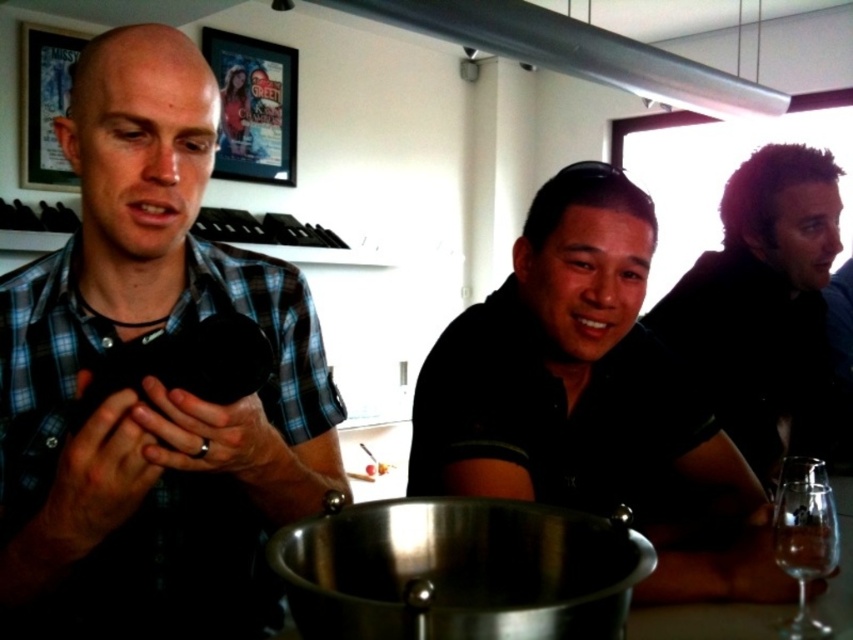
Can you confirm if dark brown hair at upper right is positioned to the left of transparent glass wine glass at lower right?

Incorrect, dark brown hair at upper right is not on the left side of transparent glass wine glass at lower right.

Is dark brown hair at upper right wider than transparent glass wine glass at lower right?

Indeed, dark brown hair at upper right has a greater width compared to transparent glass wine glass at lower right.

The height and width of the screenshot is (640, 853). Find the location of `dark brown hair at upper right`. dark brown hair at upper right is located at coordinates (764, 307).

Locate an element on the screen. This screenshot has height=640, width=853. dark brown hair at upper right is located at coordinates (764, 307).

Does blue plaid shirt at left appear on the right side of black matte shirt at center?

In fact, blue plaid shirt at left is to the left of black matte shirt at center.

Which is more to the right, blue plaid shirt at left or black matte shirt at center?

Positioned to the right is black matte shirt at center.

The height and width of the screenshot is (640, 853). I want to click on blue plaid shirt at left, so click(x=149, y=380).

The image size is (853, 640). What do you see at coordinates (149, 380) in the screenshot?
I see `blue plaid shirt at left` at bounding box center [149, 380].

Does blue plaid shirt at left appear on the right side of clear glass wine glass at lower right?

Incorrect, blue plaid shirt at left is not on the right side of clear glass wine glass at lower right.

Does point (67, 113) come behind point (763, 611)?

That is True.

The height and width of the screenshot is (640, 853). Find the location of `blue plaid shirt at left`. blue plaid shirt at left is located at coordinates (149, 380).